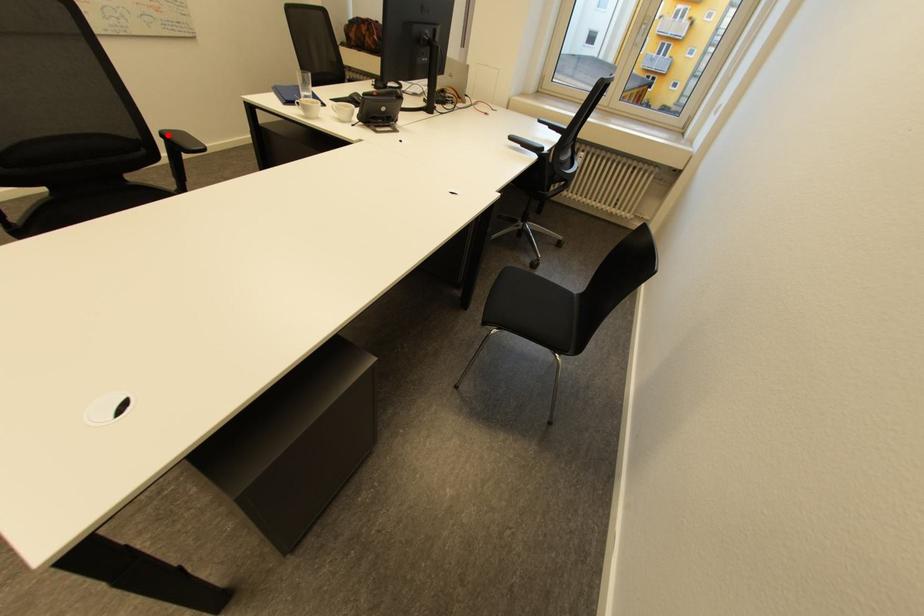
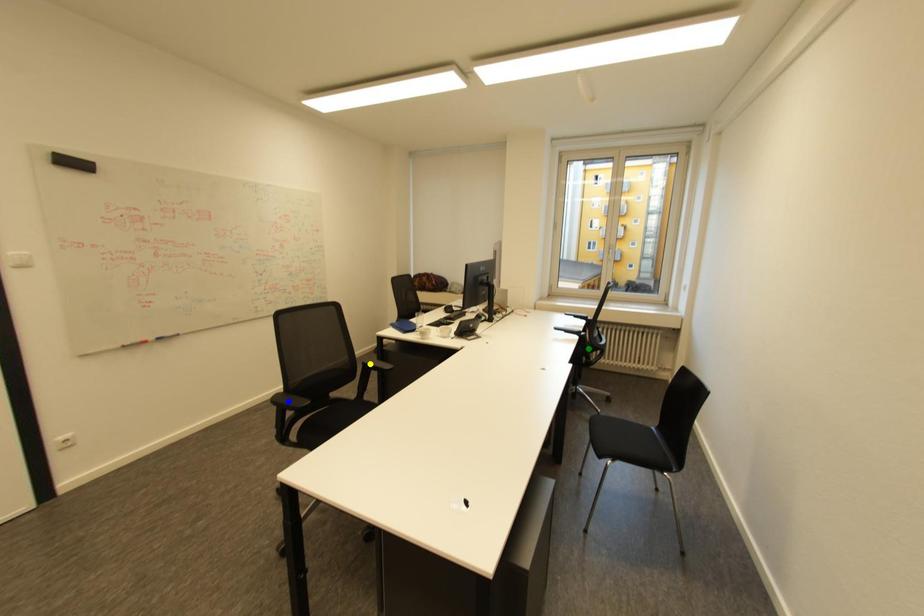
Question: I am providing you with two images of the same scene from different viewpoints. A red point is marked on the first image. You are given multiple points on the second image. Which point in image 2 represents the same 3d spot as the red point in image 1?

Choices:
 (A) green point
 (B) yellow point
 (C) blue point

Answer: (B)